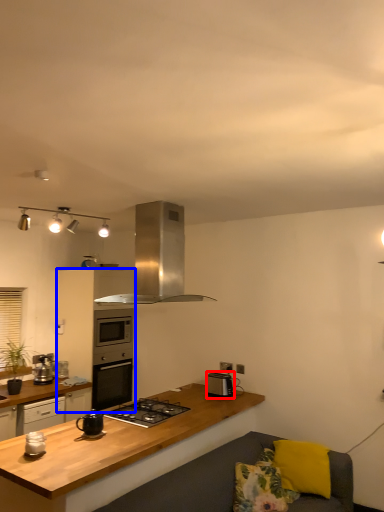
Question: Which of the following is the farthest to the observer, kitchen appliance (highlighted by a red box) or cabinetry (highlighted by a blue box)?

Choices:
 (A) kitchen appliance
 (B) cabinetry

Answer: (B)